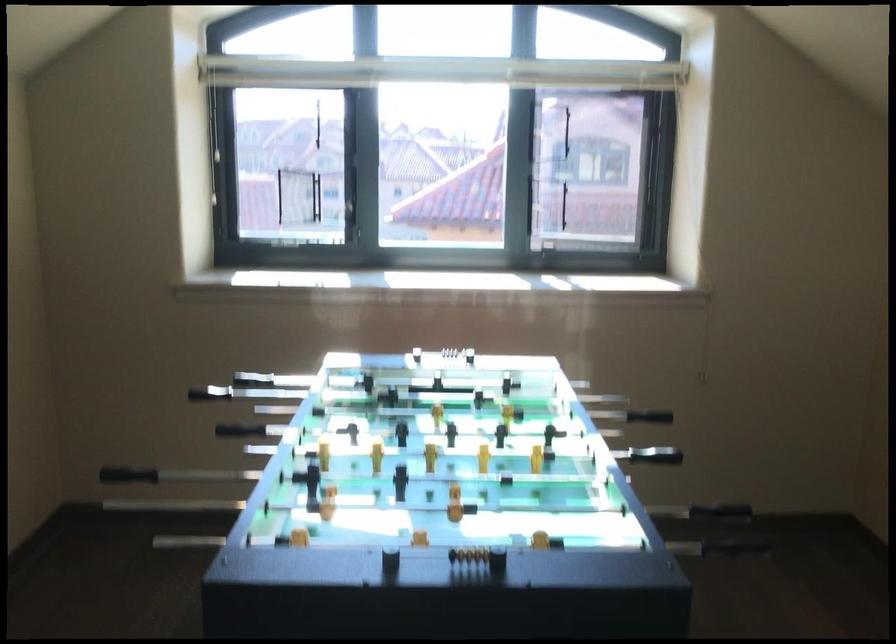
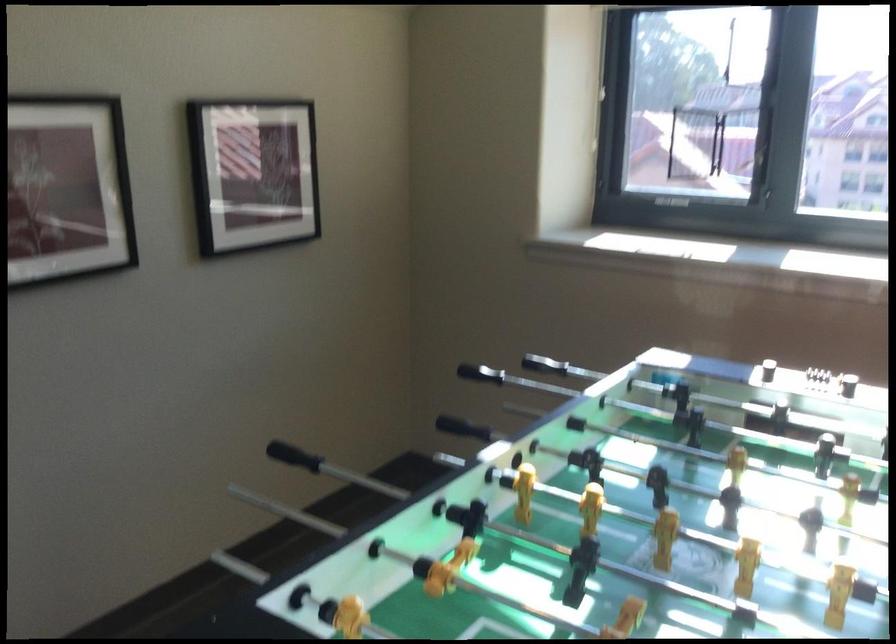
Find the pixel in the second image that matches (122,460) in the first image.

(463, 428)